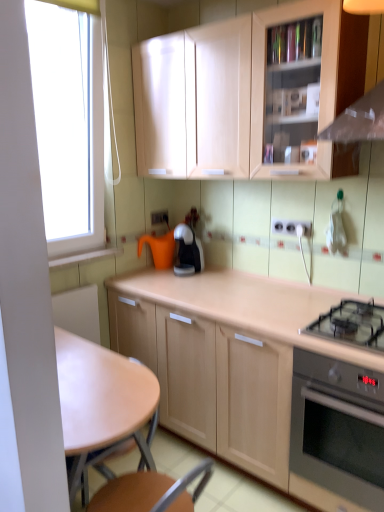
Find the location of a particular element. This screenshot has width=384, height=512. vacant region to the left of black glass gas stove at lower right is located at coordinates pyautogui.click(x=279, y=317).